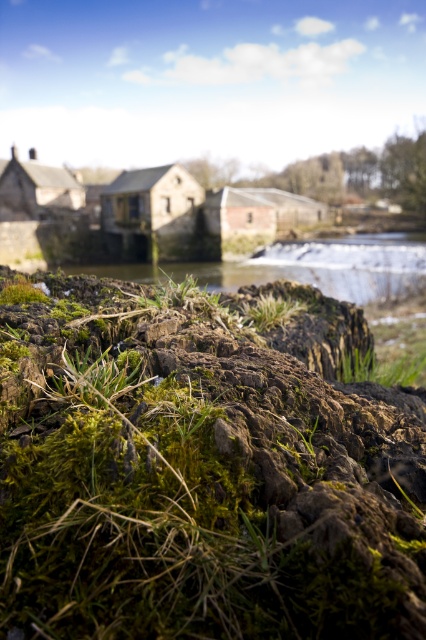
Question: Does green mossy rock at lower center appear on the left side of green mossy grass at center?

Choices:
 (A) no
 (B) yes

Answer: (B)

Question: Among these objects, which one is farthest from the camera?

Choices:
 (A) green mossy grass at center
 (B) green mossy rock at lower center

Answer: (A)

Question: Which object appears closest to the camera in this image?

Choices:
 (A) green mossy rock at lower center
 (B) green mossy grass at center

Answer: (A)

Question: From the image, what is the correct spatial relationship of green mossy rock at lower center in relation to green mossy grass at center?

Choices:
 (A) left
 (B) right

Answer: (A)

Question: Where is green mossy rock at lower center located in relation to green mossy grass at center in the image?

Choices:
 (A) below
 (B) above

Answer: (B)